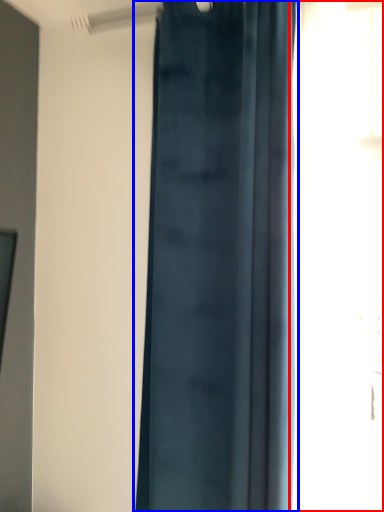
Question: Among these objects, which one is nearest to the camera, window (highlighted by a red box) or curtain (highlighted by a blue box)?

Choices:
 (A) window
 (B) curtain

Answer: (A)